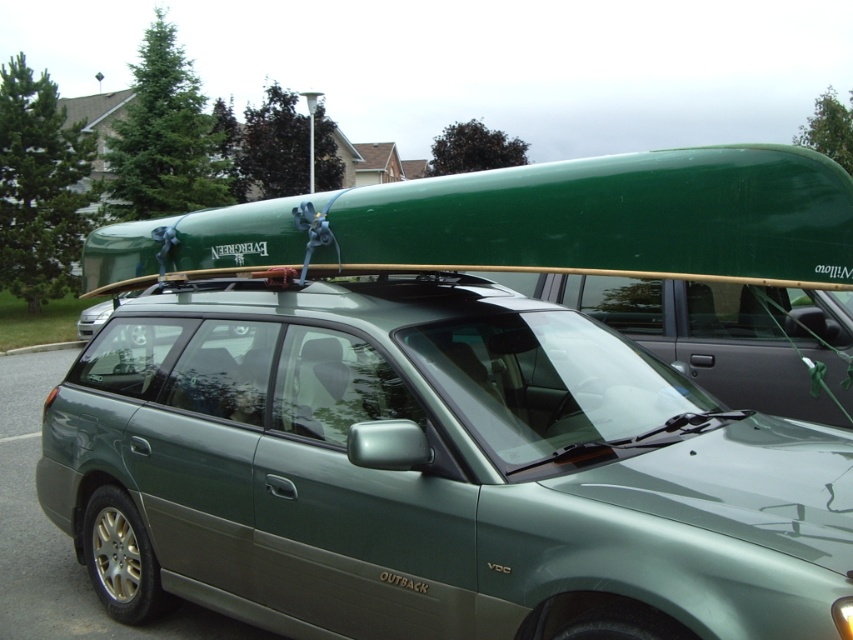
Question: In this image, where is green matte car at center located relative to green matte surfboard at upper center?

Choices:
 (A) left
 (B) right

Answer: (B)

Question: Which point is farther from the camera taking this photo?

Choices:
 (A) (833, 195)
 (B) (360, 284)

Answer: (B)

Question: Which point is closer to the camera?

Choices:
 (A) green matte surfboard at upper center
 (B) green matte car at center

Answer: (B)

Question: Observing the image, what is the correct spatial positioning of green matte car at center in reference to green matte surfboard at upper center?

Choices:
 (A) below
 (B) above

Answer: (A)

Question: Is green matte car at center smaller than green matte surfboard at upper center?

Choices:
 (A) no
 (B) yes

Answer: (A)